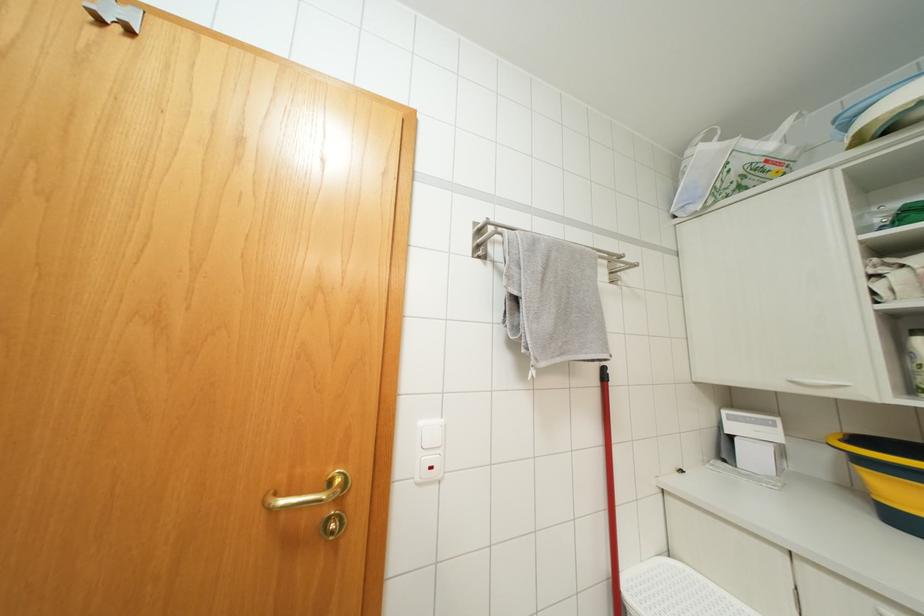
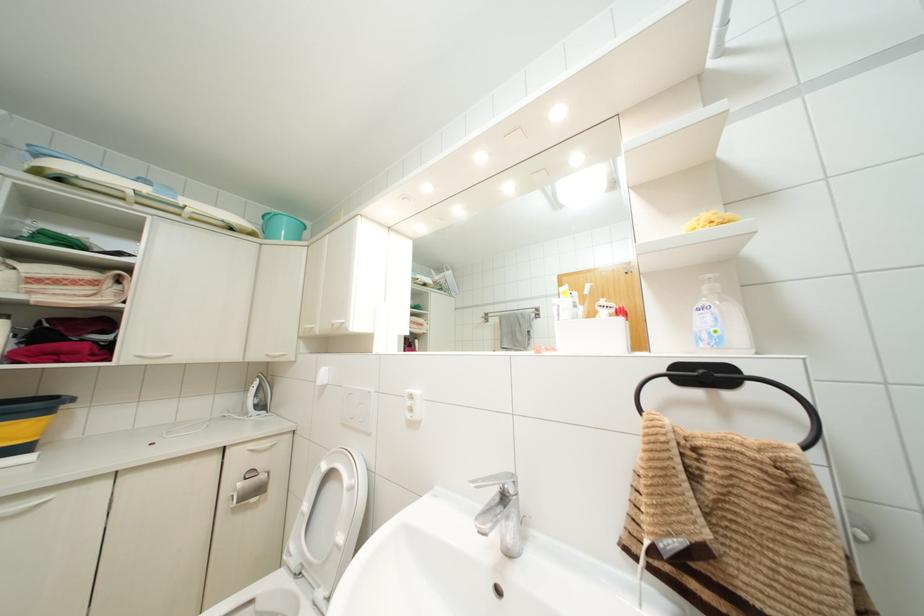
Question: Based on the continuous images, in which direction is the camera rotating? Reply with the corresponding letter.

Choices:
 (A) Left
 (B) Right
 (C) Up
 (D) Down

Answer: (B)